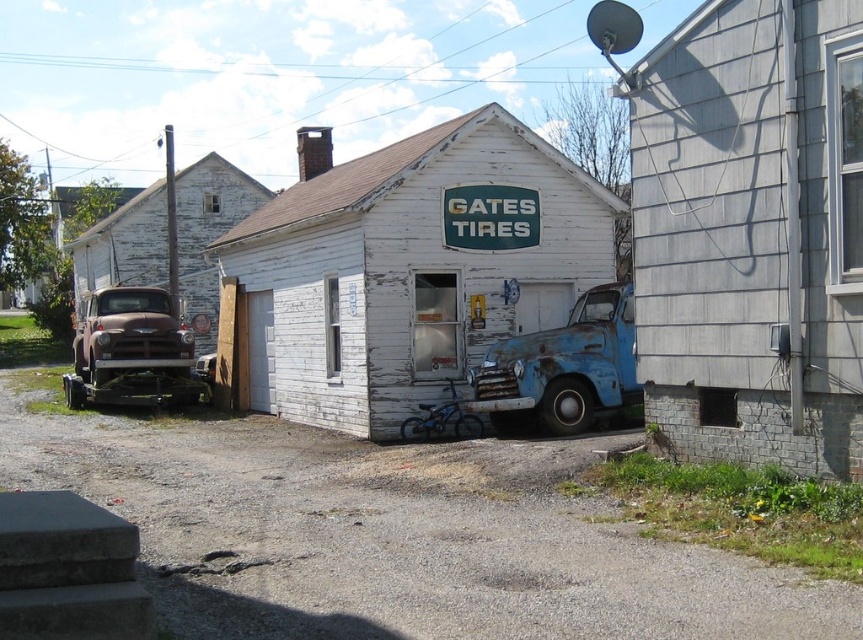
Does gray shingles at right have a lesser width compared to rusty metal truck at left?

Yes, gray shingles at right is thinner than rusty metal truck at left.

Is gray shingles at right to the left of rusty metal truck at left from the viewer's perspective?

In fact, gray shingles at right is to the right of rusty metal truck at left.

Is point (679, 52) farther from camera compared to point (104, 365)?

That is False.

What are the coordinates of `gray shingles at right` in the screenshot? It's located at (x=751, y=234).

Between gray shingles at right and white weathered wood shed at center, which one appears on the right side from the viewer's perspective?

From the viewer's perspective, gray shingles at right appears more on the right side.

Is gray shingles at right to the right of white weathered wood shed at center from the viewer's perspective?

Correct, you'll find gray shingles at right to the right of white weathered wood shed at center.

Measure the distance between point (660, 193) and camera.

9.15 meters

I want to click on gray shingles at right, so click(x=751, y=234).

Is point (597, 323) more distant than point (186, 349)?

That is False.

Does rusty metal truck at center come behind rusty metal truck at left?

No, rusty metal truck at center is closer to the viewer.

What do you see at coordinates (561, 369) in the screenshot? I see `rusty metal truck at center` at bounding box center [561, 369].

At what (x,y) coordinates should I click in order to perform the action: click on rusty metal truck at center. Please return your answer as a coordinate pair (x, y). Looking at the image, I should click on (561, 369).